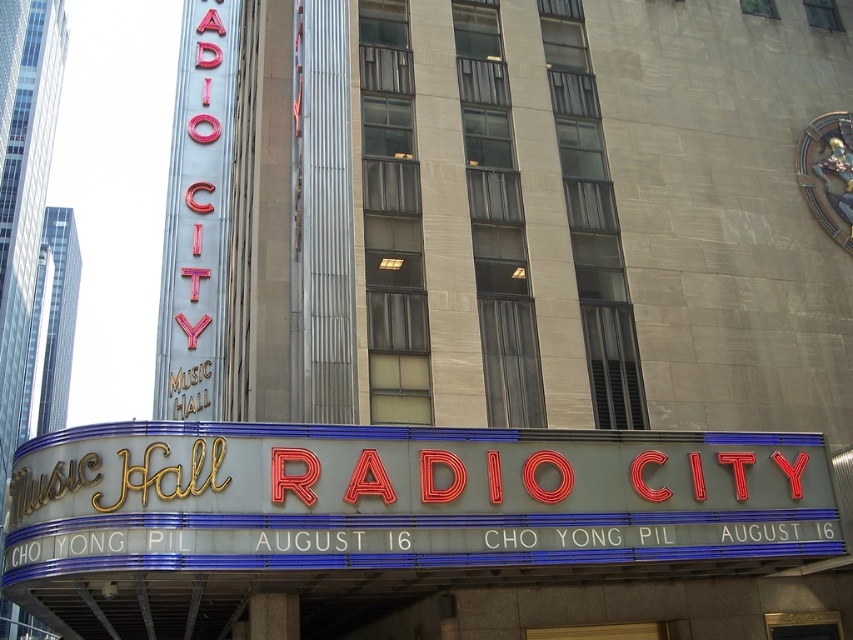
Measure the distance between point (701, 548) and camera.

Point (701, 548) and camera are 92.81 feet apart.

Between neon red sign at center and neon red sign at left, which one appears on the left side from the viewer's perspective?

neon red sign at left

Where is `neon red sign at center`? neon red sign at center is located at coordinates (408, 497).